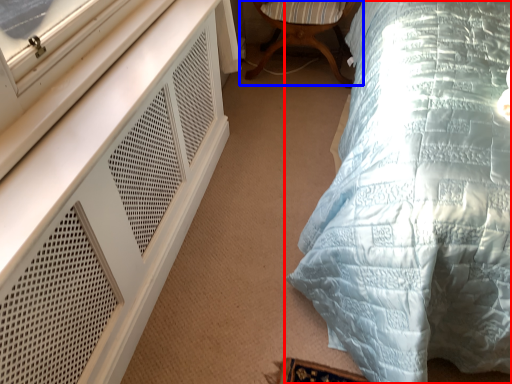
Question: Which point is closer to the camera, bed (highlighted by a red box) or chair (highlighted by a blue box)?

Choices:
 (A) bed
 (B) chair

Answer: (A)